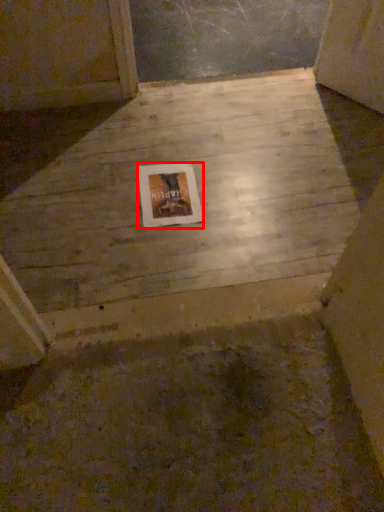
Question: Considering the relative positions of picture frame (annotated by the red box) and concrete in the image provided, where is picture frame (annotated by the red box) located with respect to the staircase?

Choices:
 (A) right
 (B) left

Answer: (B)